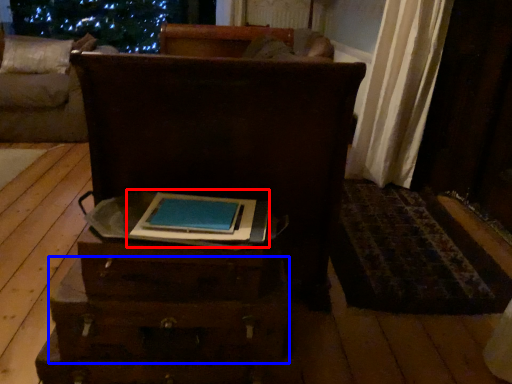
Question: Which point is further to the camera, book (highlighted by a red box) or drawer (highlighted by a blue box)?

Choices:
 (A) book
 (B) drawer

Answer: (B)